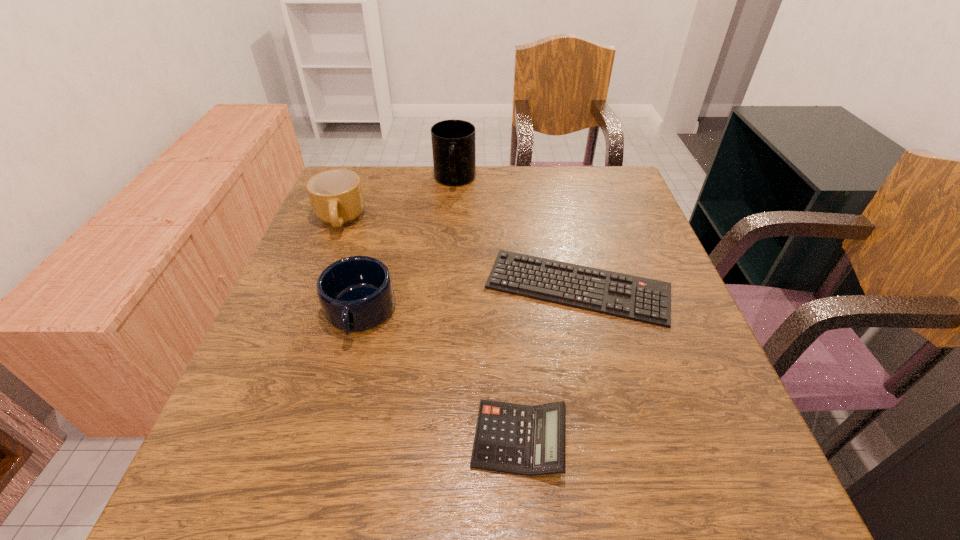
I want to click on the farthest mug, so click(453, 141).

Image resolution: width=960 pixels, height=540 pixels. I want to click on the farthest object, so click(453, 141).

This screenshot has height=540, width=960. What are the coordinates of `the second farthest object` in the screenshot? It's located at (336, 196).

Identify the location of the nearest mug. The image size is (960, 540). (356, 293).

The height and width of the screenshot is (540, 960). In order to click on calculator in this screenshot , I will do `click(527, 440)`.

I want to click on the fourth tallest object, so click(527, 440).

In order to click on the shortest object in this screenshot , I will do `click(641, 299)`.

This screenshot has width=960, height=540. Identify the location of free space located 0.250m on the side of the farthest mug with the handle. (449, 252).

The width and height of the screenshot is (960, 540). I want to click on vacant space positioned on the side with the handle of the second nearest mug, so click(x=288, y=352).

Where is `vacant space positioned 0.110m with the handle on the side of the nearest mug`? Image resolution: width=960 pixels, height=540 pixels. vacant space positioned 0.110m with the handle on the side of the nearest mug is located at coordinates (337, 397).